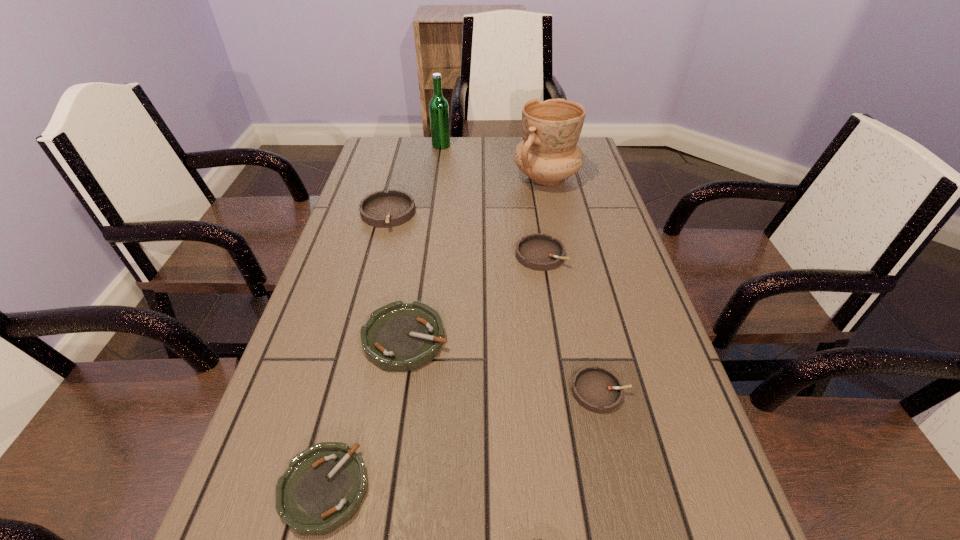
This screenshot has height=540, width=960. I want to click on the nearest ashtray, so click(323, 487).

Find the location of a particular element. The height and width of the screenshot is (540, 960). the nearest object is located at coordinates (323, 487).

The width and height of the screenshot is (960, 540). I want to click on blank space located on the front of the green beer bottle, so click(x=434, y=198).

Where is `vacant space located on the front of the pottery`? vacant space located on the front of the pottery is located at coordinates (x=560, y=242).

You are a GUI agent. You are given a task and a screenshot of the screen. Output one action in this format:
    pyautogui.click(x=<x>, y=<y>)
    Task: Click on the free space located 0.380m on the front of the farthest ashtray
    The width and height of the screenshot is (960, 540).
    Given the screenshot: What is the action you would take?
    pyautogui.click(x=352, y=347)

The image size is (960, 540). Identify the location of free space located on the back of the fourth nearest object. (528, 172).

The image size is (960, 540). Find the location of `blank space located 0.330m on the right of the farther green ashtray`. blank space located 0.330m on the right of the farther green ashtray is located at coordinates (608, 338).

Where is `vacant region located on the back of the nearest gray ashtray`? vacant region located on the back of the nearest gray ashtray is located at coordinates (568, 249).

Find the location of a particular element. The image size is (960, 540). vacant region located 0.200m on the right of the nearer green ashtray is located at coordinates (495, 489).

Find the location of a particular element. The height and width of the screenshot is (540, 960). beer bottle positioned at the far edge is located at coordinates (438, 107).